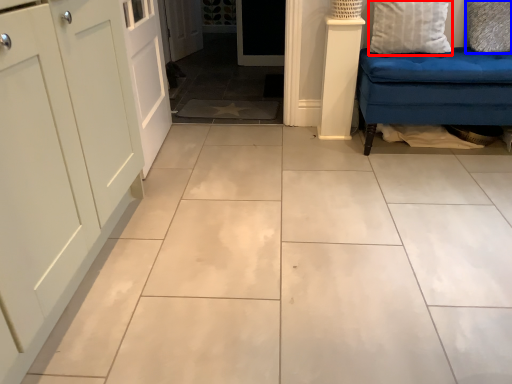
Question: Which object is closer to the camera taking this photo, pillow (highlighted by a red box) or pillow (highlighted by a blue box)?

Choices:
 (A) pillow
 (B) pillow

Answer: (A)